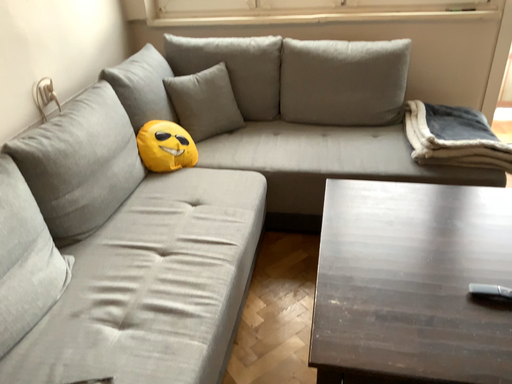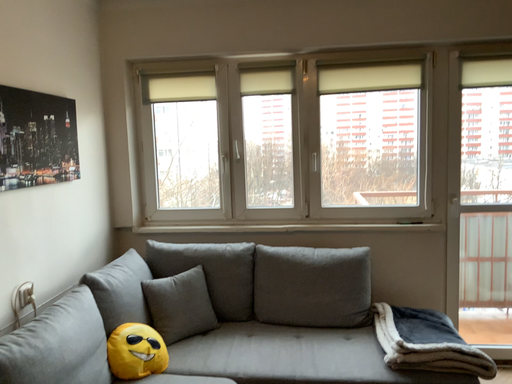
Question: How did the camera likely rotate when shooting the video?

Choices:
 (A) rotated downward
 (B) rotated upward

Answer: (B)